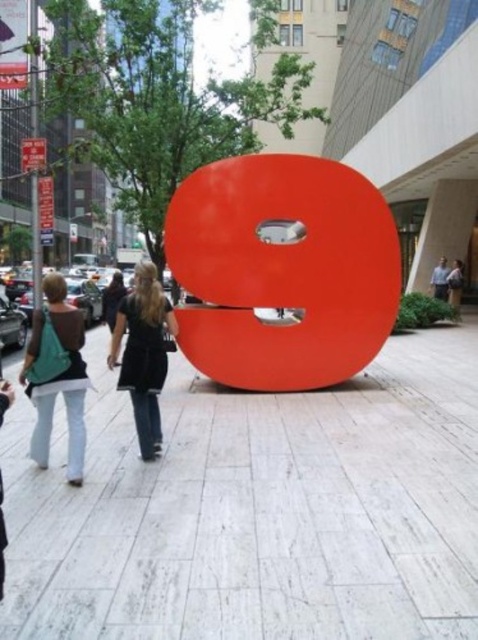
You are a city planner reviewing this area and need to ensure accessibility. Since the white stone pavement at center is below the matte orange sculpture at center, is there a risk of tripping for pedestrians walking under the sculpture?

The white stone pavement at center is located below the matte orange sculpture at center, which means the sculpture is elevated above the pavement. This setup could create a potential tripping hazard if the base of the sculpture protrudes into the walking path. Pedestrians might not notice the elevation change and could trip over the sculpture base.

You are a city planner assessing the space around the red sculpture. The white stone pavement at center and matte teal bag at left are both in the area. Which one has a narrower width?

The white stone pavement at center has a lesser width compared to the matte teal bag at left, so it is narrower.

From the picture: You are standing in the urban scene and want to place a small potted plant between the white stone pavement at center and the matte teal bag at left. Which object should the plant be closer to based on their positions?

The white stone pavement at center is closer to the viewer than the matte teal bag at left, so the plant should be placed closer to the matte teal bag at left to maintain the spatial relationship between them.